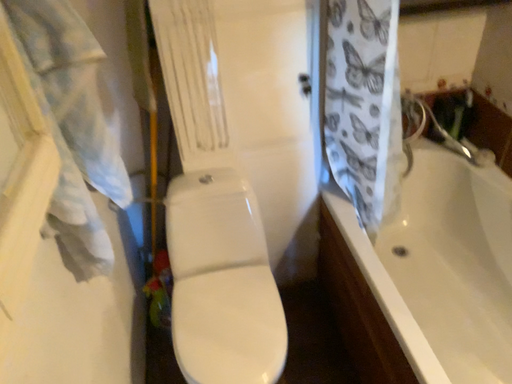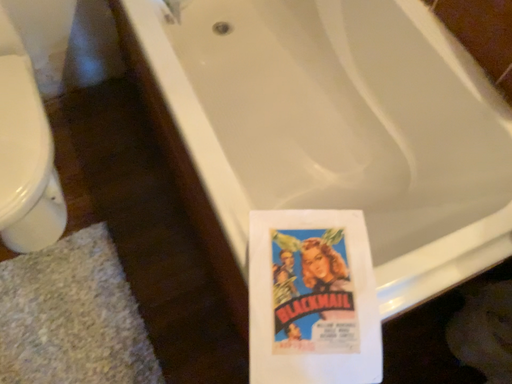
Question: Which way did the camera rotate in the video?

Choices:
 (A) rotated downward
 (B) rotated upward

Answer: (A)